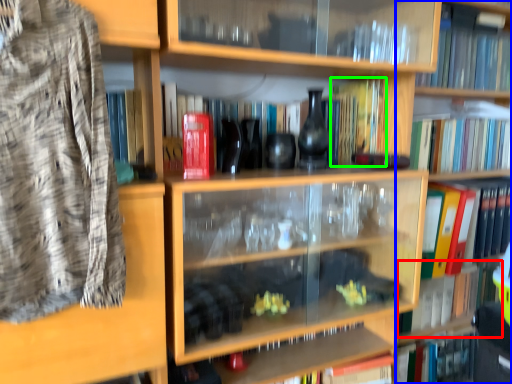
Question: Which object is the closest to the book (highlighted by a red box)? Choose among these: bookcase (highlighted by a blue box) or book (highlighted by a green box).

Choices:
 (A) bookcase
 (B) book

Answer: (A)